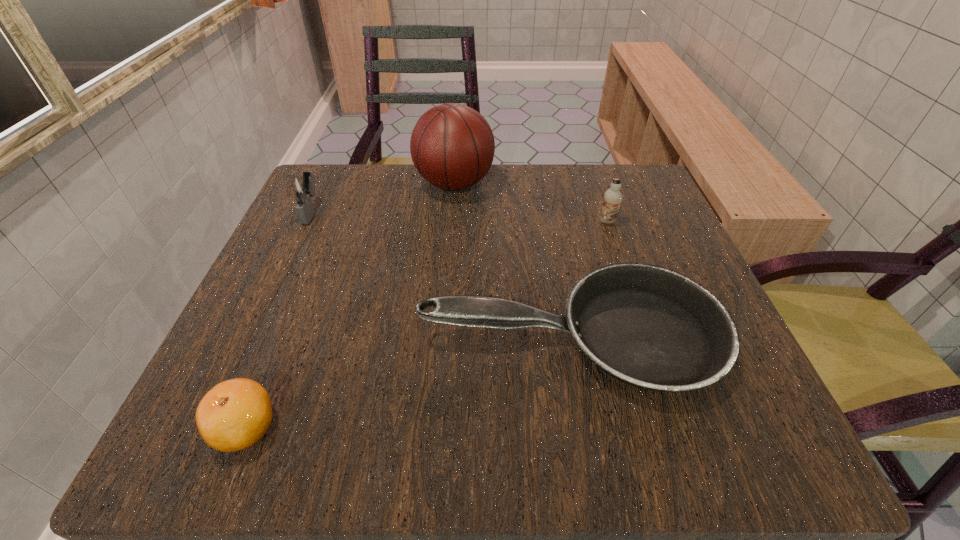
Image resolution: width=960 pixels, height=540 pixels. What are the coordinates of `the tallest object` in the screenshot? It's located at (452, 146).

In order to click on igniter in this screenshot , I will do `click(302, 188)`.

Locate an element on the screen. chocolate milk is located at coordinates (612, 198).

You are a GUI agent. You are given a task and a screenshot of the screen. Output one action in this format:
    pyautogui.click(x=<x>, y=<y>)
    Task: Click on the frying pan
    This screenshot has height=540, width=960.
    Given the screenshot: What is the action you would take?
    pyautogui.click(x=647, y=326)

The height and width of the screenshot is (540, 960). Find the location of `clementine`. clementine is located at coordinates (235, 414).

The image size is (960, 540). Find the location of `free space located 0.220m on the front of the tallest object`. free space located 0.220m on the front of the tallest object is located at coordinates (447, 280).

The image size is (960, 540). Identify the location of vacant area located on the front of the igniter. click(274, 294).

Locate an element on the screen. The width and height of the screenshot is (960, 540). vacant position located on the left of the chocolate milk is located at coordinates (535, 221).

Find the location of `vacant space situated 0.220m on the back of the frying pan`. vacant space situated 0.220m on the back of the frying pan is located at coordinates (547, 207).

You are a GUI agent. You are given a task and a screenshot of the screen. Output one action in this format:
    pyautogui.click(x=<x>, y=<y>)
    Task: Click on the vacant space situated on the right of the clementine
    Image resolution: width=960 pixels, height=540 pixels.
    Given the screenshot: What is the action you would take?
    pyautogui.click(x=332, y=427)